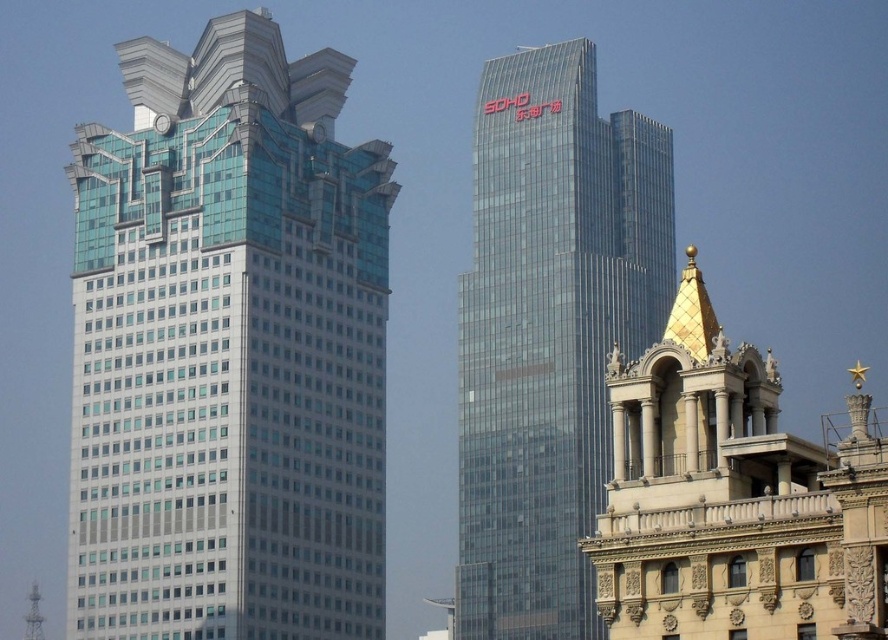
You are standing at the center of the image and want to take a photo of the glassy steel skyscraper at left. In which direction should you point your camera?

You should point your camera to the left to capture the glassy steel skyscraper at left since it is located at the left side of the image.

You are an architect evaluating the structural integrity of the glassy steel skyscraper at left and the transparent glass tower at center. Based on their sizes, which one might require more robust foundational support?

The glassy steel skyscraper at left requires more robust foundational support because it has a larger size compared to the transparent glass tower at center.